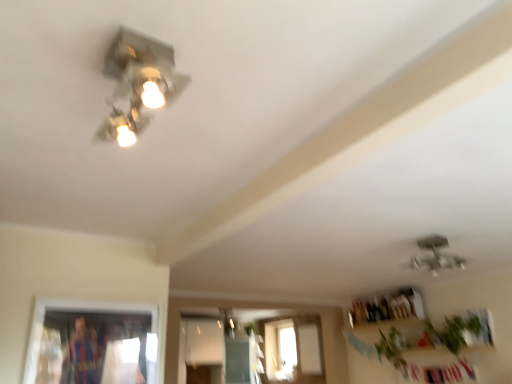
What is the approximate height of green leafy plant at lower right, the second plant viewed from the right?

17.25 inches.

Where is `green leafy plant at lower right, marked as the 1th plant in a left-to-right arrangement`? Image resolution: width=512 pixels, height=384 pixels. green leafy plant at lower right, marked as the 1th plant in a left-to-right arrangement is located at coordinates (391, 350).

The height and width of the screenshot is (384, 512). What do you see at coordinates (455, 331) in the screenshot? I see `green leafy plant at lower right, placed as the first plant when sorted from right to left` at bounding box center [455, 331].

You are a GUI agent. You are given a task and a screenshot of the screen. Output one action in this format:
    pyautogui.click(x=<x>, y=<y>)
    Task: Click on the green leafy plant at lower right, marked as the 1th plant in a left-to-right arrangement
    The image size is (512, 384).
    Given the screenshot: What is the action you would take?
    pyautogui.click(x=391, y=350)

Can you confirm if green leafy plant at lower right, marked as the 1th plant in a left-to-right arrangement, is positioned to the right of metallic silver light fixture at upper left, the third lamp when ordered from back to front?

Yes, green leafy plant at lower right, marked as the 1th plant in a left-to-right arrangement, is to the right of metallic silver light fixture at upper left, the third lamp when ordered from back to front.

Which of these two, green leafy plant at lower right, marked as the 1th plant in a left-to-right arrangement, or metallic silver light fixture at upper left, placed as the first lamp when sorted from front to back, is bigger?

Bigger between the two is green leafy plant at lower right, marked as the 1th plant in a left-to-right arrangement.

Is matte silver lamp at center, the 1th lamp positioned from the back, positioned with its back to metallic silver light fixture at upper center, the 2th lamp when ordered from top to bottom?

No, matte silver lamp at center, the 1th lamp positioned from the back,'s orientation is not away from metallic silver light fixture at upper center, the 2th lamp when ordered from top to bottom.

Considering the positions of point (224, 312) and point (410, 266), is point (224, 312) closer or farther from the camera than point (410, 266)?

Point (224, 312) is positioned farther from the camera compared to point (410, 266).

Considering the relative sizes of matte silver lamp at center, marked as the 3th lamp in a top-to-bottom arrangement, and metallic silver light fixture at upper center, the second lamp viewed from the front, in the image provided, is matte silver lamp at center, marked as the 3th lamp in a top-to-bottom arrangement, shorter than metallic silver light fixture at upper center, the second lamp viewed from the front,?

No, matte silver lamp at center, marked as the 3th lamp in a top-to-bottom arrangement, is not shorter than metallic silver light fixture at upper center, the second lamp viewed from the front.

Does matte silver lamp at center, marked as the 3th lamp in a top-to-bottom arrangement, have a larger size compared to metallic silver light fixture at upper center, the 2th lamp positioned from the bottom?

No, matte silver lamp at center, marked as the 3th lamp in a top-to-bottom arrangement, is not bigger than metallic silver light fixture at upper center, the 2th lamp positioned from the bottom.

Between point (226, 334) and point (478, 317), which one is positioned behind?

Positioned behind is point (226, 334).

Is matte silver lamp at center, the third lamp positioned from the front, facing away from green leafy plant at lower right, placed as the first plant when sorted from right to left?

matte silver lamp at center, the third lamp positioned from the front, does not have its back to green leafy plant at lower right, placed as the first plant when sorted from right to left.

Can you confirm if matte silver lamp at center, which is the 1th lamp in bottom-to-top order, is taller than green leafy plant at lower right, acting as the 2th plant starting from the back?

No.

From the picture: Considering the relative sizes of metallic silver light fixture at upper center, the second lamp viewed from the front, and green leafy plant at lower right, the second plant viewed from the right, in the image provided, is metallic silver light fixture at upper center, the second lamp viewed from the front, thinner than green leafy plant at lower right, the second plant viewed from the right,?

In fact, metallic silver light fixture at upper center, the second lamp viewed from the front, might be wider than green leafy plant at lower right, the second plant viewed from the right.

Does metallic silver light fixture at upper center, positioned as the first lamp in right-to-left order, have a smaller size compared to green leafy plant at lower right, the second plant viewed from the right?

Yes, metallic silver light fixture at upper center, positioned as the first lamp in right-to-left order, is smaller than green leafy plant at lower right, the second plant viewed from the right.

Can green leafy plant at lower right, the second plant when ordered from front to back, be found inside metallic silver light fixture at upper center, the second lamp viewed from the front?

No, green leafy plant at lower right, the second plant when ordered from front to back, is not inside metallic silver light fixture at upper center, the second lamp viewed from the front.

Does green leafy plant at lower right, the 1th plant from the back, have a lesser height compared to matte silver lamp at center, which is the 1th lamp in bottom-to-top order?

No.

Who is bigger, green leafy plant at lower right, the second plant viewed from the right, or matte silver lamp at center, the third lamp positioned from the front?

Bigger between the two is green leafy plant at lower right, the second plant viewed from the right.

Identify the location of the 1st lamp positioned above the green leafy plant at lower right, the second plant viewed from the right (from a real-world perspective). click(x=229, y=323).

From the image's perspective, is green leafy plant at lower right, the second plant viewed from the right, on top of matte silver lamp at center, arranged as the first lamp when viewed from the left?

Yes, from the image's perspective, green leafy plant at lower right, the second plant viewed from the right, is above matte silver lamp at center, arranged as the first lamp when viewed from the left.

From the image's perspective, which one is positioned lower, matte silver lamp at center, the 1th lamp positioned from the back, or green leafy plant at lower right, the 1th plant from the back?

matte silver lamp at center, the 1th lamp positioned from the back.

From a real-world perspective, between matte silver lamp at center, which is the 1th lamp in bottom-to-top order, and green leafy plant at lower right, the 1th plant from the back, who is vertically lower?

From a 3D spatial view, green leafy plant at lower right, the 1th plant from the back, is below.

Looking at this image, is matte silver lamp at center, which is counted as the third lamp, starting from the right, taller or shorter than green leafy plant at lower right, the second plant when ordered from front to back?

matte silver lamp at center, which is counted as the third lamp, starting from the right, is shorter than green leafy plant at lower right, the second plant when ordered from front to back.

Choose the correct answer: Is matte silver lamp at center, marked as the 3th lamp in a top-to-bottom arrangement, inside green leafy plant at lower right, the second plant viewed from the right, or outside it?

The correct answer is: outside.

In the scene shown: How different are the orientations of green leafy plant at lower right, which is the second plant in left-to-right order, and metallic silver light fixture at upper center, the 2th lamp positioned from the bottom, in degrees?

The angular difference between green leafy plant at lower right, which is the second plant in left-to-right order, and metallic silver light fixture at upper center, the 2th lamp positioned from the bottom, is 84.5 degrees.

Can metallic silver light fixture at upper center, the 2th lamp positioned from the bottom, be found inside green leafy plant at lower right, which is the second plant in left-to-right order?

Actually, metallic silver light fixture at upper center, the 2th lamp positioned from the bottom, is outside green leafy plant at lower right, which is the second plant in left-to-right order.

Visually, is green leafy plant at lower right, acting as the 2th plant starting from the back, positioned to the left or to the right of metallic silver light fixture at upper center, positioned as the first lamp in right-to-left order?

green leafy plant at lower right, acting as the 2th plant starting from the back, is positioned on metallic silver light fixture at upper center, positioned as the first lamp in right-to-left order,'s right side.

From the image's perspective, which one is positioned higher, green leafy plant at lower right, acting as the 2th plant starting from the back, or metallic silver light fixture at upper center, the 2th lamp positioned from the bottom?

metallic silver light fixture at upper center, the 2th lamp positioned from the bottom, appears higher in the image.

From the green leafy plant at lower right, marked as the 1th plant in a left-to-right arrangement, count the 2nd lamp to the left and point to it. Please provide its 2D coordinates.

[(138, 83)]

You are a GUI agent. You are given a task and a screenshot of the screen. Output one action in this format:
    pyautogui.click(x=<x>, y=<y>)
    Task: Click on the lamp below the metallic silver light fixture at upper center, the 2th lamp positioned from the bottom (from the image's perspective)
    
    Given the screenshot: What is the action you would take?
    pyautogui.click(x=229, y=323)

Looking at the image, which one is located further to metallic silver light fixture at upper left, the third lamp positioned from the bottom, metallic silver light fixture at upper center, placed as the third lamp when sorted from left to right, or matte silver lamp at center, the 1th lamp positioned from the back?

The object further to metallic silver light fixture at upper left, the third lamp positioned from the bottom, is matte silver lamp at center, the 1th lamp positioned from the back.

From the image, which object appears to be nearer to metallic silver light fixture at upper left, acting as the 1th lamp starting from the top, green leafy plant at lower right, the second plant viewed from the right, or matte silver lamp at center, the third lamp positioned from the front?

Among the two, green leafy plant at lower right, the second plant viewed from the right, is located nearer to metallic silver light fixture at upper left, acting as the 1th lamp starting from the top.

Considering their positions, is metallic silver light fixture at upper left, acting as the 1th lamp starting from the top, positioned closer to green leafy plant at lower right, marked as the 1th plant in a left-to-right arrangement, than green leafy plant at lower right, acting as the first plant starting from the front?

green leafy plant at lower right, acting as the first plant starting from the front.

When comparing their distances from green leafy plant at lower right, the second plant when ordered from front to back, does metallic silver light fixture at upper center, positioned as the first lamp in right-to-left order, or matte silver lamp at center, which is the 1th lamp in bottom-to-top order, seem closer?

metallic silver light fixture at upper center, positioned as the first lamp in right-to-left order, is closer to green leafy plant at lower right, the second plant when ordered from front to back.

Considering their positions, is metallic silver light fixture at upper left, the third lamp positioned from the bottom, positioned closer to metallic silver light fixture at upper center, the 2th lamp positioned from the bottom, than green leafy plant at lower right, the second plant viewed from the right?

green leafy plant at lower right, the second plant viewed from the right, is positioned closer to the anchor metallic silver light fixture at upper center, the 2th lamp positioned from the bottom.

Estimate the real-world distances between objects in this image. Which object is further from matte silver lamp at center, which is counted as the third lamp, starting from the right, green leafy plant at lower right, which is the second plant in left-to-right order, or metallic silver light fixture at upper left, the third lamp when ordered from back to front?

Based on the image, metallic silver light fixture at upper left, the third lamp when ordered from back to front, appears to be further to matte silver lamp at center, which is counted as the third lamp, starting from the right.

Which object lies nearer to the anchor point metallic silver light fixture at upper left, the second lamp positioned from the left, green leafy plant at lower right, the 1th plant from the back, or metallic silver light fixture at upper center, positioned as the first lamp in right-to-left order?

metallic silver light fixture at upper center, positioned as the first lamp in right-to-left order, is closer to metallic silver light fixture at upper left, the second lamp positioned from the left.

Considering their positions, is matte silver lamp at center, the 1th lamp positioned from the back, positioned further to green leafy plant at lower right, which is the second plant in left-to-right order, than green leafy plant at lower right, the second plant when ordered from front to back?

matte silver lamp at center, the 1th lamp positioned from the back, is positioned further to the anchor green leafy plant at lower right, which is the second plant in left-to-right order.

The image size is (512, 384). I want to click on lamp between metallic silver light fixture at upper left, the second lamp positioned from the left, and green leafy plant at lower right, acting as the 2th plant starting from the back, in the front-back direction, so click(x=435, y=255).

At what (x,y) coordinates should I click in order to perform the action: click on lamp between metallic silver light fixture at upper left, the third lamp when ordered from back to front, and green leafy plant at lower right, marked as the 1th plant in a left-to-right arrangement, in the front-back direction. Please return your answer as a coordinate pair (x, y). Looking at the image, I should click on (435, 255).

Where is `plant located between green leafy plant at lower right, acting as the first plant starting from the front, and matte silver lamp at center, marked as the 3th lamp in a top-to-bottom arrangement, in the depth direction`? Image resolution: width=512 pixels, height=384 pixels. plant located between green leafy plant at lower right, acting as the first plant starting from the front, and matte silver lamp at center, marked as the 3th lamp in a top-to-bottom arrangement, in the depth direction is located at coordinates (391, 350).

Where is `plant located between metallic silver light fixture at upper center, the second lamp viewed from the front, and green leafy plant at lower right, the second plant when ordered from front to back, in the depth direction`? plant located between metallic silver light fixture at upper center, the second lamp viewed from the front, and green leafy plant at lower right, the second plant when ordered from front to back, in the depth direction is located at coordinates (455, 331).